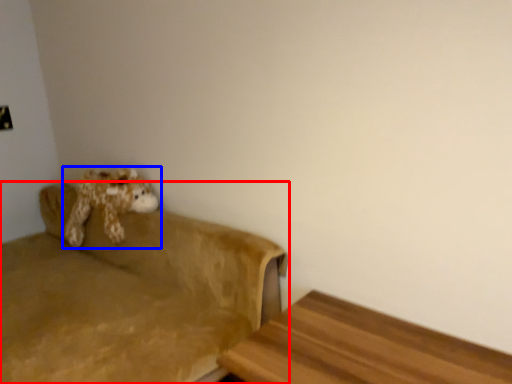
Question: Which point is closer to the camera, studio couch (highlighted by a red box) or toy (highlighted by a blue box)?

Choices:
 (A) studio couch
 (B) toy

Answer: (A)